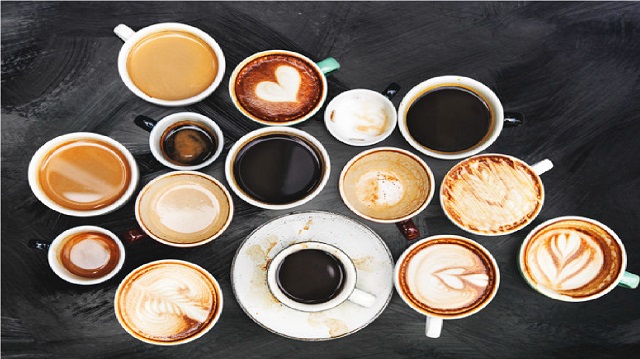
You are a GUI agent. You are given a task and a screenshot of the screen. Output one action in this format:
    pyautogui.click(x=<x>, y=<y>)
    Task: Click on the cup handles
    This screenshot has width=640, height=359.
    Given the screenshot: What is the action you would take?
    pyautogui.click(x=433, y=324), pyautogui.click(x=365, y=299), pyautogui.click(x=548, y=167), pyautogui.click(x=628, y=273), pyautogui.click(x=333, y=63), pyautogui.click(x=122, y=31)